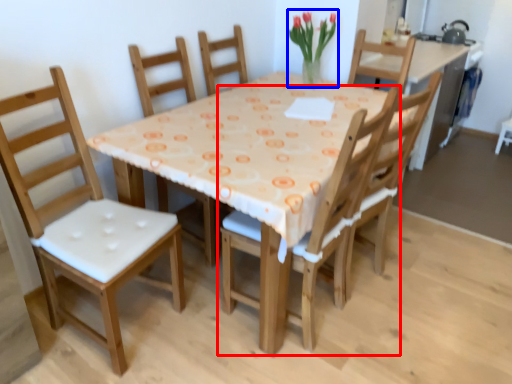
Question: Which of the following is the closest to the observer, chair (highlighted by a red box) or floral arrangement (highlighted by a blue box)?

Choices:
 (A) chair
 (B) floral arrangement

Answer: (A)